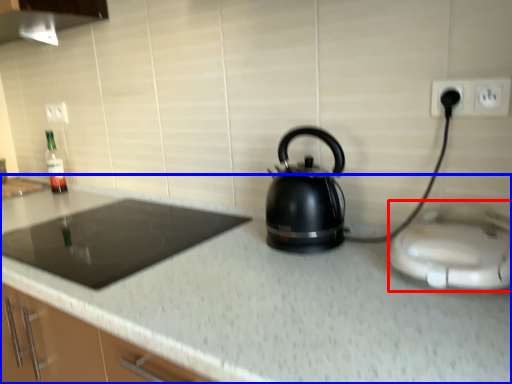
Question: Which object appears farthest to the camera in this image, appliance (highlighted by a red box) or countertop (highlighted by a blue box)?

Choices:
 (A) appliance
 (B) countertop

Answer: (A)